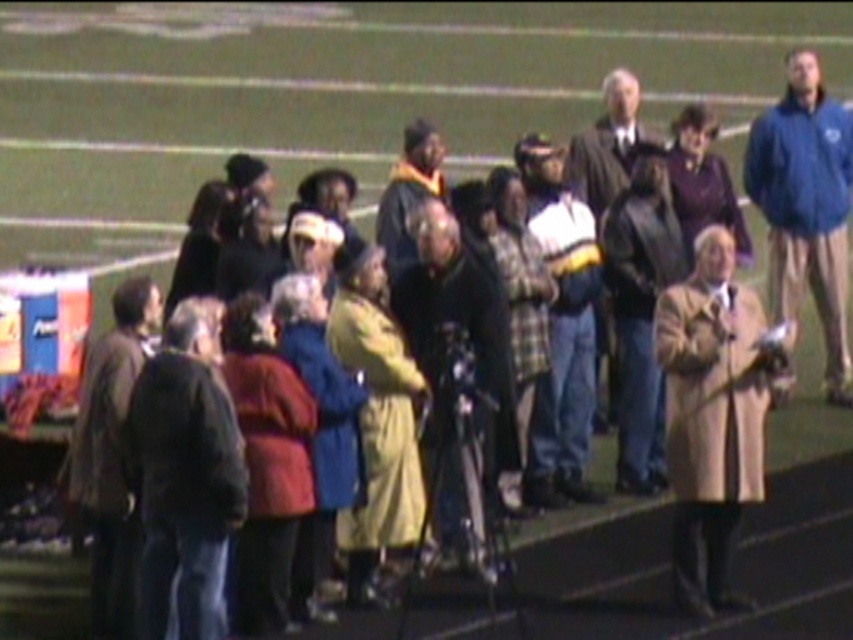
You are a photographer at the event and want to capture a photo that includes both the blue fleece jacket at upper right and the black leather jacket at center. Considering their heights, which jacket will appear taller in the photo?

The blue fleece jacket at upper right will appear taller in the photo because it has a greater height compared to the black leather jacket at center.

You are standing at the center of the sports field and see the brown leather jacket at left. Which direction should you walk to reach it?

The brown leather jacket at left is located at point (111, 452), which is to the left side of the field. You should walk to your left to reach it.